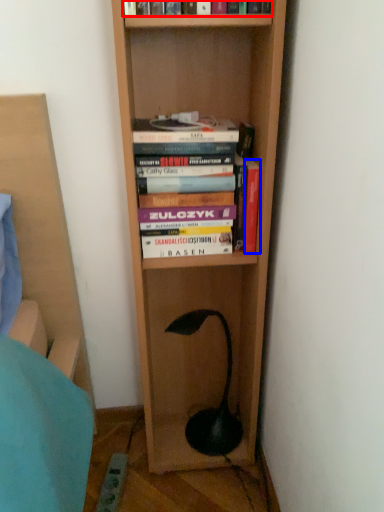
Question: Which point is further to the camera, book (highlighted by a red box) or book (highlighted by a blue box)?

Choices:
 (A) book
 (B) book

Answer: (B)